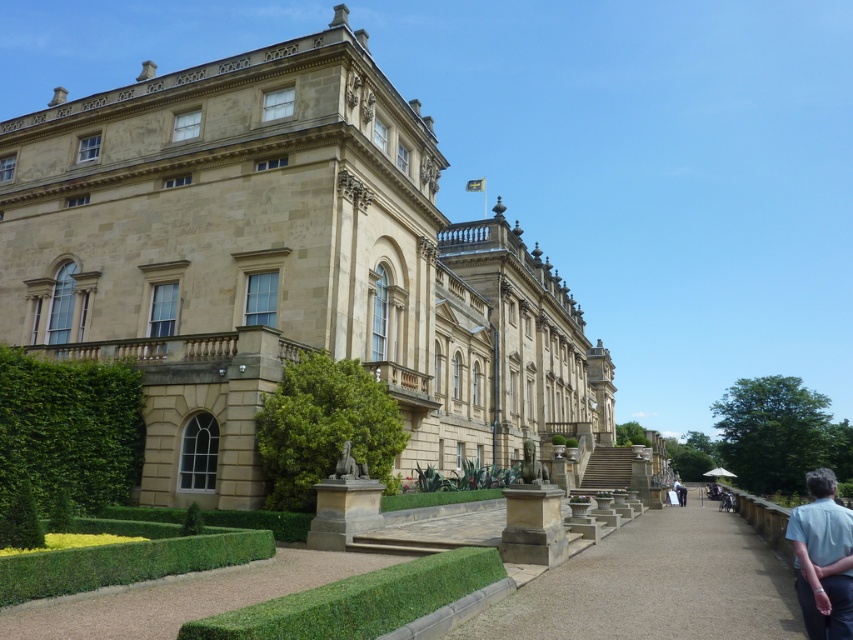
You are a visitor standing at the entrance of the beige stone palace at center. You want to take a photo of the palace with the green leafy hedge at lower left in the background. Will the hedge be fully visible in the photo if you frame the palace in the center?

The beige stone palace at center is taller than the green leafy hedge at lower left. Since the palace is taller, the hedge might be partially obscured by the palace when framed centrally, so the hedge may not be fully visible in the photo.

You are standing in front of the classical building and want to reach a specific point marked at coordinates point (293, 42). If your current position is 50 meters away from the building, can you walk directly to that point without moving closer than 50 meters to the building?

The distance of point (293, 42) from camera is 64.10 meters. Since you are currently 50 meters away from the building, moving to the point would require moving to 64.10 meters away, which is further back. Therefore, you can walk directly to that point without moving closer than 50 meters to the building.

You are a visitor standing at the front of the grand classical building and see the green leafy hedge at center and the light blue shirt at lower right. Which object is taller?

The green leafy hedge at center is taller than the light blue shirt at lower right according to the description.